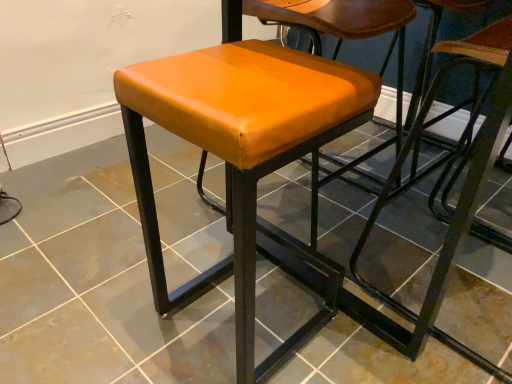
Find the location of a particular element. Image resolution: width=512 pixels, height=384 pixels. free space behind orange leather stool at center is located at coordinates (218, 243).